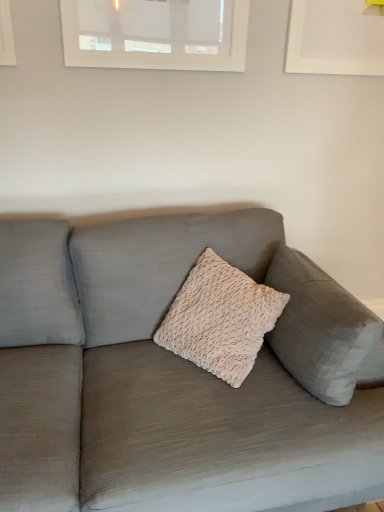
Question: Is matte gray couch at center facing towards white textured window at upper center?

Choices:
 (A) yes
 (B) no

Answer: (B)

Question: Can you confirm if matte gray couch at center is taller than white textured window at upper center?

Choices:
 (A) no
 (B) yes

Answer: (B)

Question: From the image's perspective, would you say matte gray couch at center is positioned over white textured window at upper center?

Choices:
 (A) no
 (B) yes

Answer: (A)

Question: Can you confirm if matte gray couch at center is positioned to the right of white textured window at upper center?

Choices:
 (A) no
 (B) yes

Answer: (B)

Question: Can you confirm if matte gray couch at center is shorter than white textured window at upper center?

Choices:
 (A) no
 (B) yes

Answer: (A)

Question: Considering the relative sizes of matte gray couch at center and white textured window at upper center in the image provided, is matte gray couch at center wider than white textured window at upper center?

Choices:
 (A) no
 (B) yes

Answer: (B)

Question: Does white textured window at upper center have a greater height compared to matte gray couch at center?

Choices:
 (A) no
 (B) yes

Answer: (A)

Question: Could you tell me if white textured window at upper center is turned towards matte gray couch at center?

Choices:
 (A) yes
 (B) no

Answer: (B)

Question: From the image's perspective, is white textured window at upper center on top of matte gray couch at center?

Choices:
 (A) no
 (B) yes

Answer: (B)

Question: From a real-world perspective, is white textured window at upper center positioned over matte gray couch at center based on gravity?

Choices:
 (A) no
 (B) yes

Answer: (B)

Question: Would you say white textured window at upper center is a long distance from matte gray couch at center?

Choices:
 (A) no
 (B) yes

Answer: (A)

Question: Is white textured window at upper center thinner than matte gray couch at center?

Choices:
 (A) no
 (B) yes

Answer: (B)

Question: Based on their sizes in the image, would you say white textured window at upper center is bigger or smaller than matte gray couch at center?

Choices:
 (A) small
 (B) big

Answer: (A)